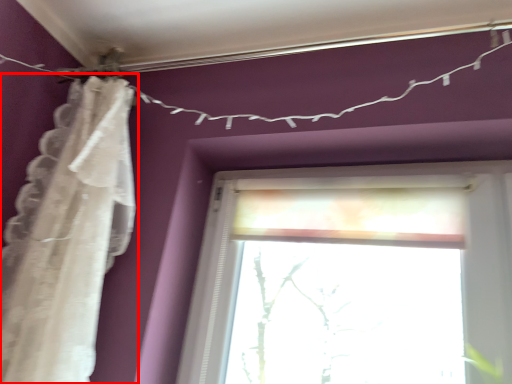
Question: From the image's perspective, considering the relative positions of curtain (annotated by the red box) and clothesline in the image provided, where is curtain (annotated by the red box) located with respect to the staircase?

Choices:
 (A) above
 (B) below

Answer: (B)